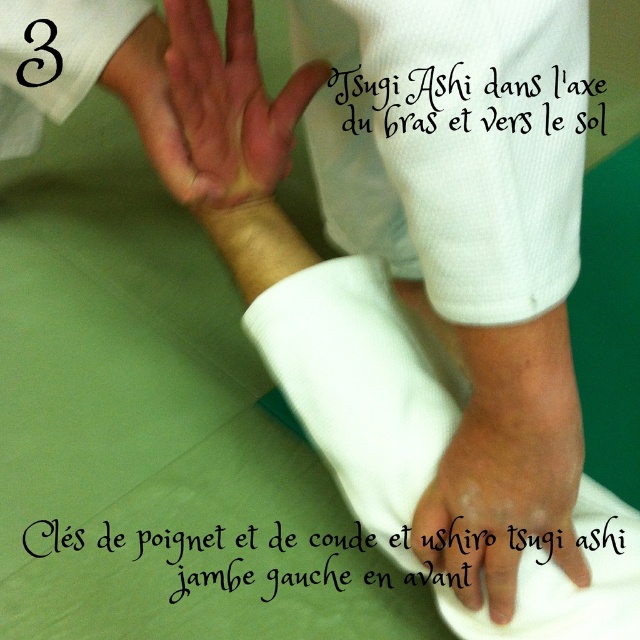
You are a martial arts instructor observing a student practicing a Tsugi Ashi move. The student is positioned in front of you. Where exactly is the white matte hand at center located in relation to the student?

The white matte hand at center is located at point [502,496].

You are observing a martial arts demonstration and notice two parts of the practitioner in the center. The white matte hand at center and the pinkish skin at center. Which one takes up more area in the image?

The pinkish skin at center takes up more area than the white matte hand at center in the image.